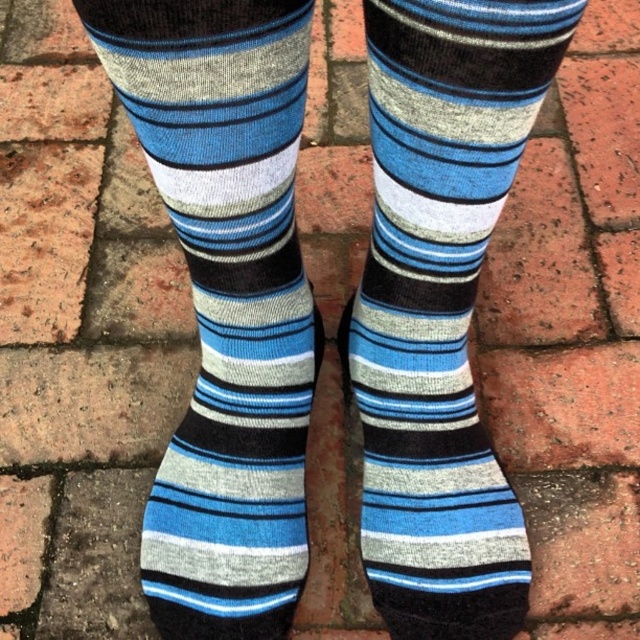
You are a tailor measuring the distance between two blue striped socks for a custom fit. The socks are labeled as blue striped sock at left and blue striped sock at center. According to the measurements, how far apart are these two socks?

The blue striped sock at left is 15.02 centimeters away from the blue striped sock at center.

You are standing at the point marked as point (x=168, y=45) and want to take a photo of the socks. The camera you have can only focus on objects within 60 centimeters. Will the camera be able to focus on the socks?

The distance between point (x=168, y=45) and the camera is 64.02 centimeters, which is beyond the camera focus range of 60 centimeters. Therefore, the camera will not be able to focus on the socks.